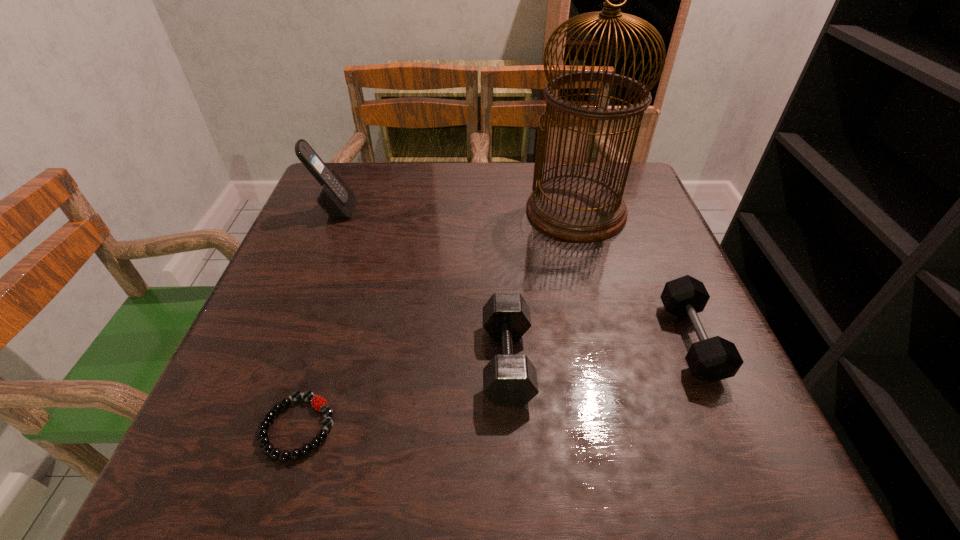
The height and width of the screenshot is (540, 960). I want to click on birdcage that is at the far edge, so click(578, 207).

Where is `cellular telephone that is at the far edge`? This screenshot has height=540, width=960. cellular telephone that is at the far edge is located at coordinates (335, 197).

What are the coordinates of `object located in the near edge section of the desktop` in the screenshot? It's located at (318, 402).

Identify the location of cellular telephone that is at the left edge. The height and width of the screenshot is (540, 960). (335, 197).

I want to click on bracelet situated at the left edge, so click(x=318, y=402).

Where is `birdcage that is at the right edge`? birdcage that is at the right edge is located at coordinates (578, 207).

You are a GUI agent. You are given a task and a screenshot of the screen. Output one action in this format:
    pyautogui.click(x=<x>, y=<y>)
    Task: Click on the dumbbell that is at the right edge
    The image size is (960, 540).
    Given the screenshot: What is the action you would take?
    pyautogui.click(x=712, y=359)

Locate an element on the screen. The width and height of the screenshot is (960, 540). object at the far left corner is located at coordinates (335, 197).

Identify the location of object at the near left corner. 318,402.

This screenshot has height=540, width=960. Find the location of `object present at the far right corner`. object present at the far right corner is located at coordinates (578, 207).